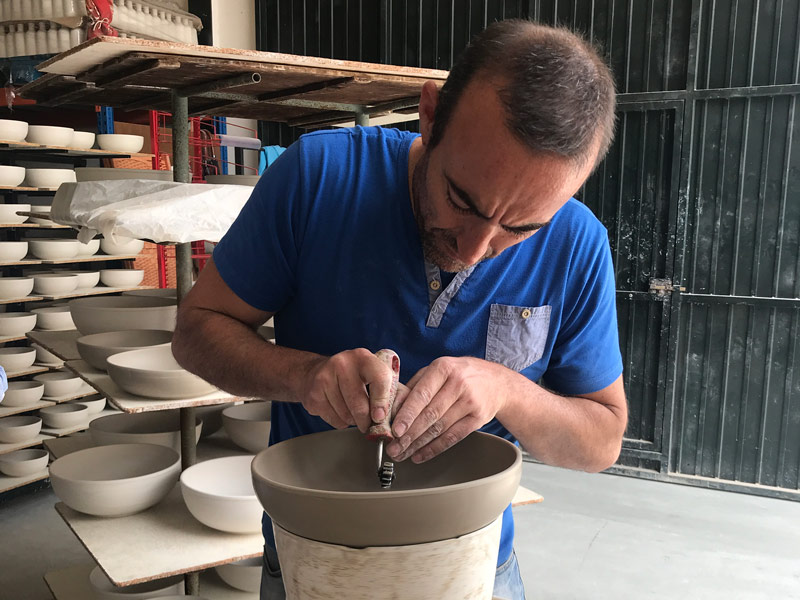
Where is `red shelf`? This screenshot has height=600, width=800. red shelf is located at coordinates tap(212, 147).